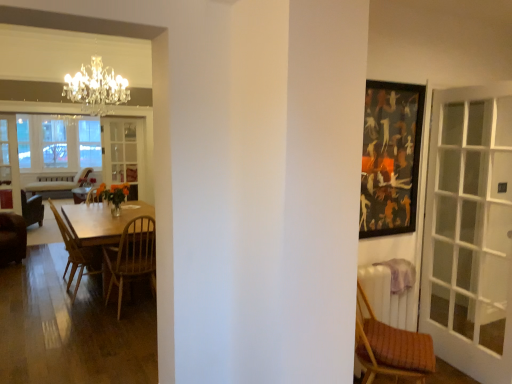
Question: Which is correct: wooden chair at left, which is counted as the third chair, starting from the right, is inside clear glass screen door at center, placed as the 1th screen door when sorted from right to left, or outside of it?

Choices:
 (A) outside
 (B) inside

Answer: (A)

Question: Does point (87, 258) appear closer or farther from the camera than point (138, 185)?

Choices:
 (A) farther
 (B) closer

Answer: (B)

Question: Based on their relative distances, which object is farther from the brown leather chair at left, the first chair when ordered from back to front?

Choices:
 (A) wooden table at left
 (B) wooden textured chair at right, the first chair from the front
 (C) clear glass screen door at center, acting as the first screen door starting from the back
 (D) clear glass screen door at left, acting as the 1th screen door starting from the left
 (E) dark wood picture frame at upper right

Answer: (B)

Question: Which object is positioned closest to the clear glass screen door at center, acting as the first screen door starting from the back?

Choices:
 (A) clear glass screen door at left, acting as the 1th screen door starting from the left
 (B) dark wood picture frame at upper right
 (C) wooden textured chair at right, the first chair from the front
 (D) wooden chair at left, which is the third chair from front to back
 (E) brown leather chair at left, which is the fourth chair in front-to-back order

Answer: (A)